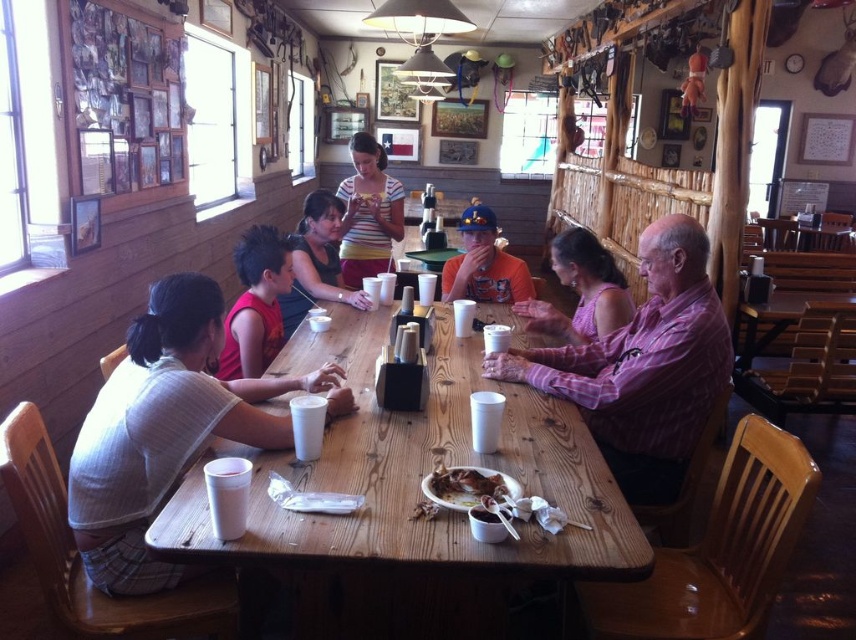
Question: Which point is closer to the camera taking this photo?

Choices:
 (A) (474, 472)
 (B) (687, 224)
 (C) (235, 332)

Answer: (A)

Question: Does red sleeveless shirt at left appear on the right side of pink satin blouse at center?

Choices:
 (A) no
 (B) yes

Answer: (A)

Question: Does red sleeveless shirt at left lie in front of matte black shirt at center?

Choices:
 (A) no
 (B) yes

Answer: (B)

Question: Is the position of orange cotton shirt at center less distant than that of brown matte meat at center?

Choices:
 (A) yes
 (B) no

Answer: (B)

Question: Estimate the real-world distances between objects in this image. Which object is farther from the striped cotton shirt at center?

Choices:
 (A) red sleeveless shirt at left
 (B) white striped shirt at left
 (C) matte black shirt at center
 (D) brown matte meat at center

Answer: (D)

Question: Estimate the real-world distances between objects in this image. Which object is farther from the pink satin blouse at center?

Choices:
 (A) brown matte meat at center
 (B) striped cotton shirt at center

Answer: (B)